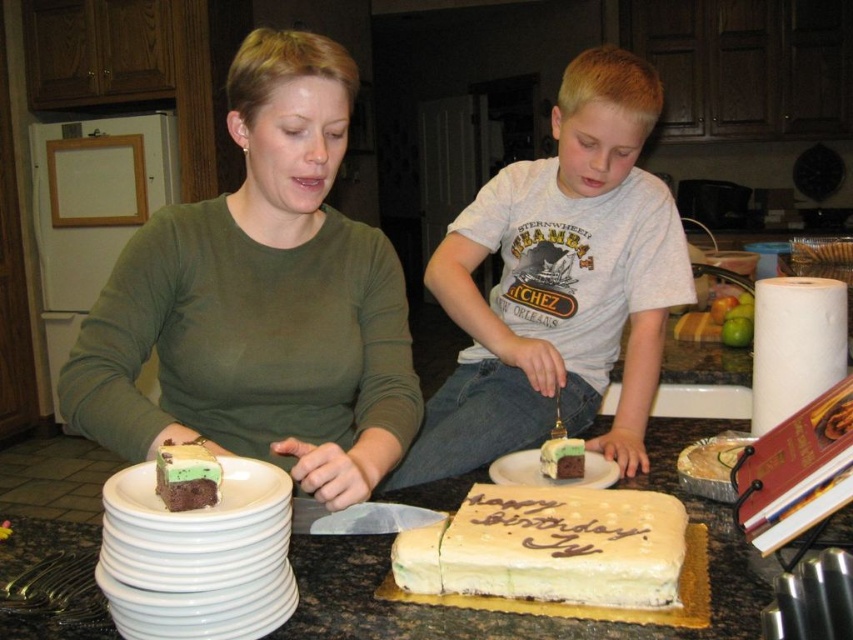
You are a guest at a birthday party and see the matte green shirt at center and the white cotton shirt at center. Which shirt is nearer to you?

The matte green shirt at center is closer to the viewer than the white cotton shirt at center, so the matte green shirt at center is nearer to you.

You are a chef in a kitchen and need to place the white ceramic plate at center on the counter without touching the white cotton shirt at center. Is this possible given their sizes?

The white cotton shirt at center is wider than the white ceramic plate at center, so placing the plate without touching the shirt depends on the available space between them. However, since the shirt is wider, there might be enough space if positioned carefully.